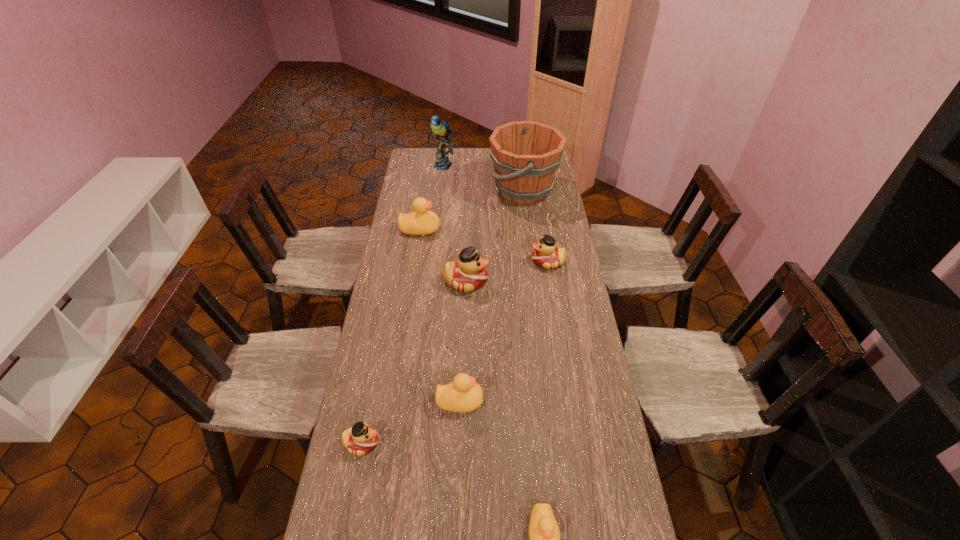
Where is `the fifth closest duck relative to the second nearest duck`? This screenshot has height=540, width=960. the fifth closest duck relative to the second nearest duck is located at coordinates (420, 222).

Locate an element on the screen. This screenshot has height=540, width=960. the second closest duck relative to the bucket is located at coordinates tap(546, 255).

Select which red duck is the second closest to the parrot. Please provide its 2D coordinates. Your answer should be formatted as a tuple, i.e. [(x, y)], where the tuple contains the x and y coordinates of a point satisfying the conditions above.

[(469, 273)]

Identify which red duck is the second nearest to the rightmost duck. Please provide its 2D coordinates. Your answer should be formatted as a tuple, i.e. [(x, y)], where the tuple contains the x and y coordinates of a point satisfying the conditions above.

[(360, 439)]

What are the coordinates of `yellow duck that is the second closest to the fifth duck from left to right` in the screenshot? It's located at (420, 222).

Locate which yellow duck is the closest to the rightmost yellow duck. Please provide its 2D coordinates. Your answer should be formatted as a tuple, i.e. [(x, y)], where the tuple contains the x and y coordinates of a point satisfying the conditions above.

[(462, 395)]

You are a GUI agent. You are given a task and a screenshot of the screen. Output one action in this format:
    pyautogui.click(x=<x>, y=<y>)
    Task: Click on the free space that satisfies the following two spatial constraints: 1. on the face of the parrot; 2. on the face of the smallest red duck
    The image size is (960, 540).
    Given the screenshot: What is the action you would take?
    pyautogui.click(x=412, y=443)